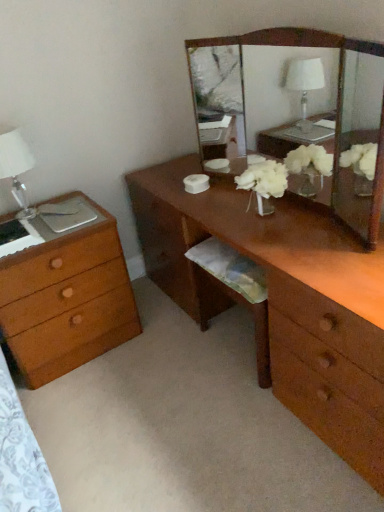
Where is `vacant space situated on the left part of brown wooden desk at center`? The image size is (384, 512). vacant space situated on the left part of brown wooden desk at center is located at coordinates (137, 375).